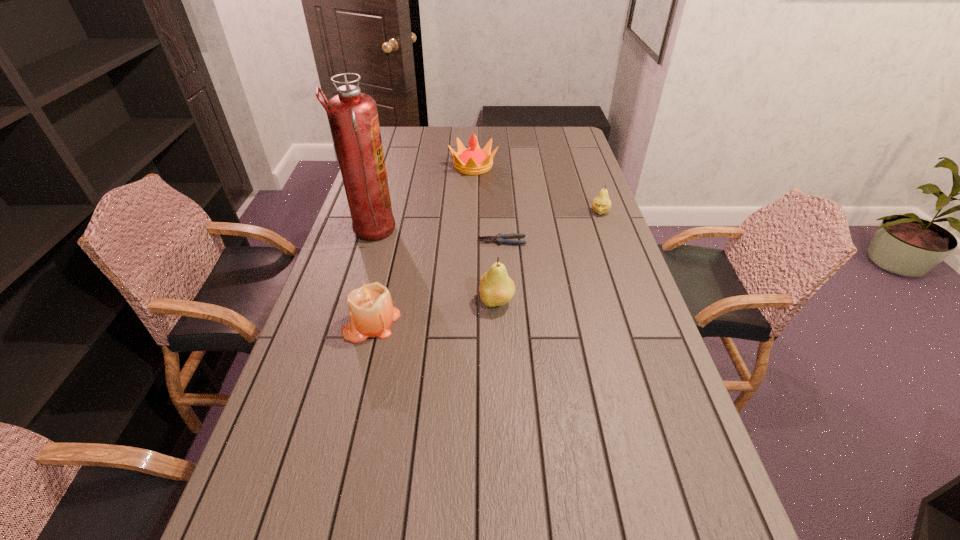
Where is `blank area located on the side of the fire extinguisher with the label`? The image size is (960, 540). blank area located on the side of the fire extinguisher with the label is located at coordinates (469, 232).

Locate an element on the screen. This screenshot has height=540, width=960. vacant region located 0.080m on the right of the farthest object is located at coordinates (517, 166).

Identify the location of vacant space located 0.290m at the gripping part of the pliers. The image size is (960, 540). (391, 241).

At what (x,y) coordinates should I click in order to perform the action: click on vacant region located at the gripping part of the pliers. Please return your answer as a coordinate pair (x, y). This screenshot has width=960, height=540. Looking at the image, I should click on (403, 241).

You are a GUI agent. You are given a task and a screenshot of the screen. Output one action in this format:
    pyautogui.click(x=<x>, y=<y>)
    Task: Click on the free space located at the gripping part of the pliers
    The width and height of the screenshot is (960, 540).
    Given the screenshot: What is the action you would take?
    pyautogui.click(x=382, y=241)

At what (x,y) coordinates should I click in order to perform the action: click on free space located on the back of the candle. Please return your answer as a coordinate pair (x, y). This screenshot has height=540, width=960. Looking at the image, I should click on (387, 261).

Locate an element on the screen. The width and height of the screenshot is (960, 540). fire extinguisher present at the left edge is located at coordinates (353, 116).

I want to click on candle present at the left edge, so click(371, 310).

Locate an element on the screen. The width and height of the screenshot is (960, 540). object at the right edge is located at coordinates (601, 204).

The height and width of the screenshot is (540, 960). In the image, there is a desktop. Find the location of `free space at the far edge`. free space at the far edge is located at coordinates (438, 142).